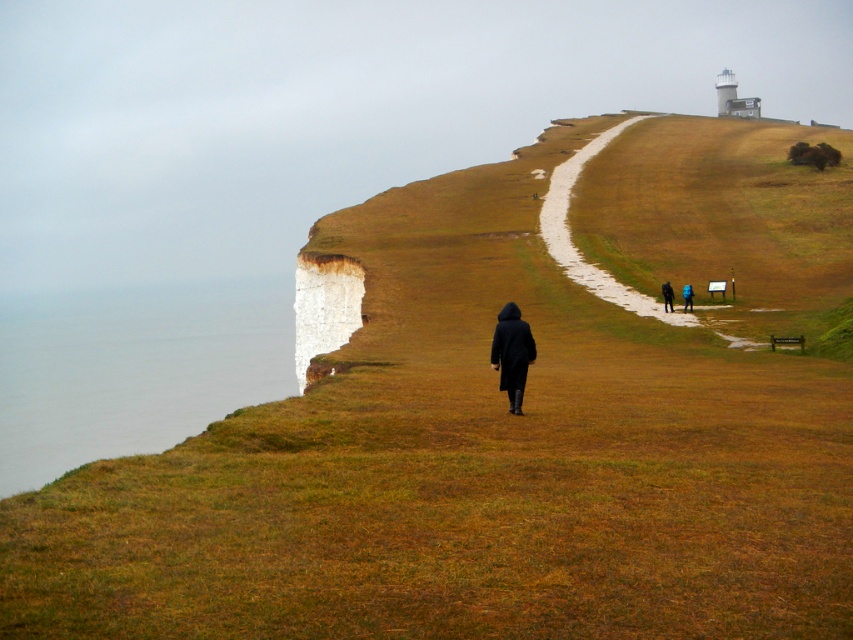
You are standing at the base of the chalk cliff and want to reach the point at coordinates point [639,116]. Given that your maximum walking distance is 300 meters, can you reach it without exceeding your limit?

The distance of point [639,116] from camera is 278.47 meters, so yes, you can reach it without exceeding your 300 meter limit.

You are standing at the camera position observing the coastal landscape. There is a point marked at coordinates point (x=341, y=259). Can you determine if this point is within a safe distance for taking a clear photo without needing a zoom lens? Assume a safe distance for a clear photo without zoom is up to 250 feet.

The point (x=341, y=259) is 280.12 feet away from the camera, which exceeds the safe distance of 250 feet for taking a clear photo without a zoom lens. Therefore, it may be difficult to capture a clear image of this point without zooming in.